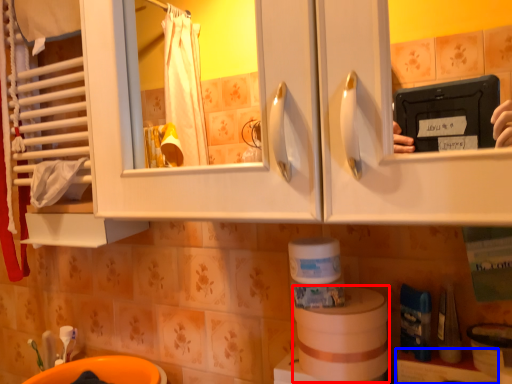
Question: Which object is further to the camera taking this photo, toilet paper (highlighted by a red box) or shelf (highlighted by a blue box)?

Choices:
 (A) toilet paper
 (B) shelf

Answer: (A)